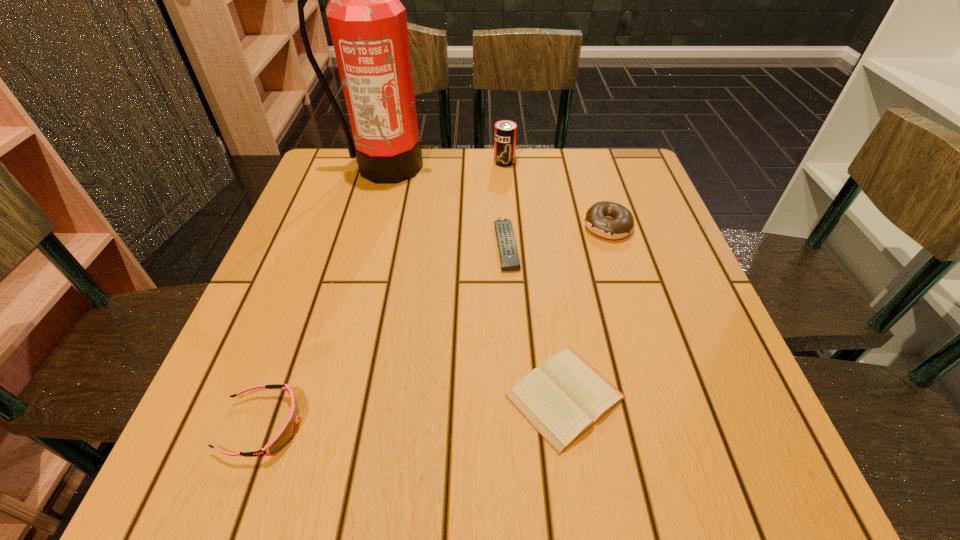
You are a GUI agent. You are given a task and a screenshot of the screen. Output one action in this format:
    pyautogui.click(x=<x>, y=<y>)
    Task: Click on the blank space that satisfies the following two spatial constraints: 1. on the front side of the diary; 2. on the front-facing side of the goggles
    
    Given the screenshot: What is the action you would take?
    tap(569, 425)

You are a GUI agent. You are given a task and a screenshot of the screen. Output one action in this format:
    pyautogui.click(x=<x>, y=<y>)
    Task: Click on the free location that satisfies the following two spatial constraints: 1. on the front side of the tallest object; 2. on the front-facing side of the goggles
    
    Given the screenshot: What is the action you would take?
    pyautogui.click(x=312, y=425)

The image size is (960, 540). In order to click on vacant position in the image that satisfies the following two spatial constraints: 1. on the front side of the fire extinguisher; 2. on the right side of the diary in this screenshot , I will do `click(320, 396)`.

The height and width of the screenshot is (540, 960). I want to click on free region that satisfies the following two spatial constraints: 1. on the back side of the diary; 2. on the left side of the rightmost object, so click(x=540, y=226).

Identify the location of vacant region that satisfies the following two spatial constraints: 1. on the back side of the doughnut; 2. on the right side of the diary. (540, 226).